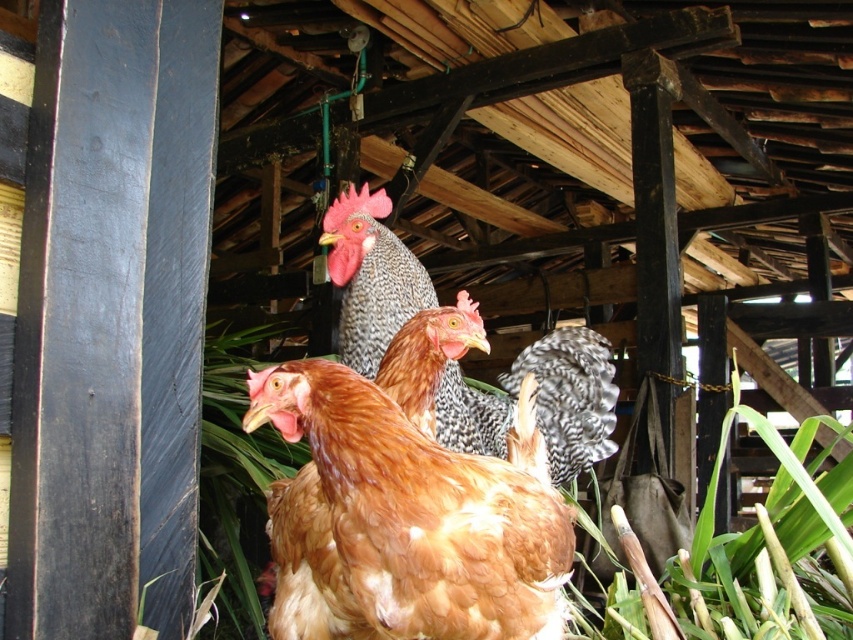
Question: Can you confirm if speckled feathered chicken at center is smaller than speckled feathered rooster at center?

Choices:
 (A) no
 (B) yes

Answer: (A)

Question: Which point appears closest to the camera in this image?

Choices:
 (A) (253, 408)
 (B) (495, 403)
 (C) (368, 298)

Answer: (A)

Question: Which of the following is the farthest from the observer?

Choices:
 (A) speckled feathered rooster at center
 (B) brown feathered chicken at center

Answer: (A)

Question: From the image, what is the correct spatial relationship of speckled feathered chicken at center in relation to speckled feathered rooster at center?

Choices:
 (A) left
 (B) right

Answer: (B)

Question: Does speckled feathered chicken at center appear on the left side of speckled feathered rooster at center?

Choices:
 (A) no
 (B) yes

Answer: (A)

Question: Which point is farther to the camera?

Choices:
 (A) (543, 408)
 (B) (467, 624)

Answer: (A)